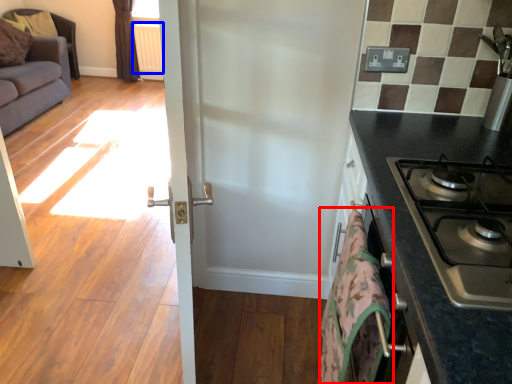
Question: Which object is closer to the camera taking this photo, blanket (highlighted by a red box) or radiator (highlighted by a blue box)?

Choices:
 (A) blanket
 (B) radiator

Answer: (A)